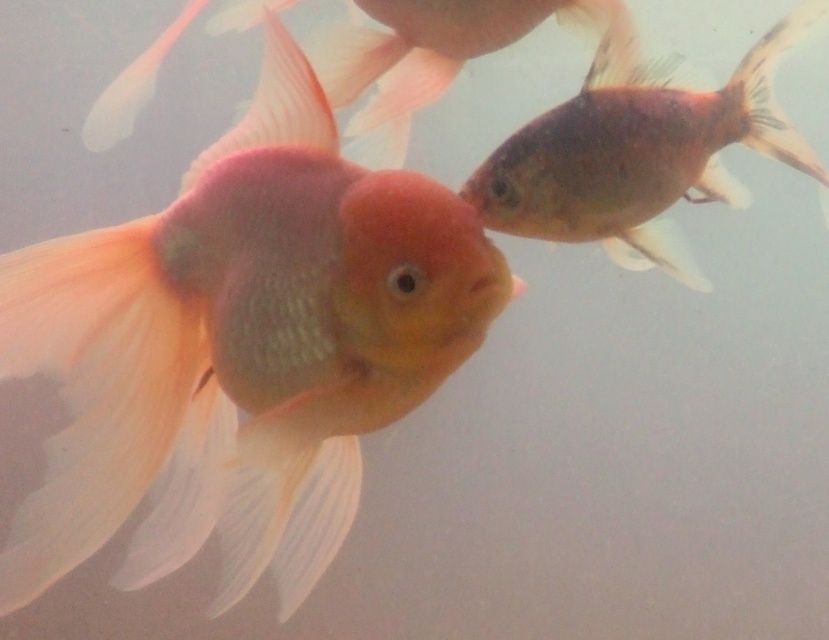
Is point (337, 141) closer to camera compared to point (602, 76)?

Yes.

What do you see at coordinates (240, 348) in the screenshot? The width and height of the screenshot is (829, 640). I see `matte goldfish at left` at bounding box center [240, 348].

Find the location of a particular element. matte goldfish at left is located at coordinates (240, 348).